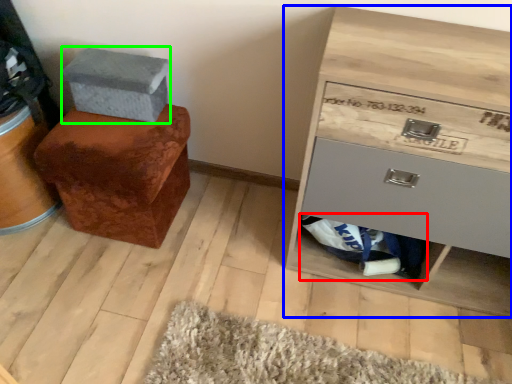
Question: Based on their relative distances, which object is nearer to material (highlighted by a red box)? Choose from chest of drawers (highlighted by a blue box) and shoe box (highlighted by a green box).

Choices:
 (A) chest of drawers
 (B) shoe box

Answer: (A)